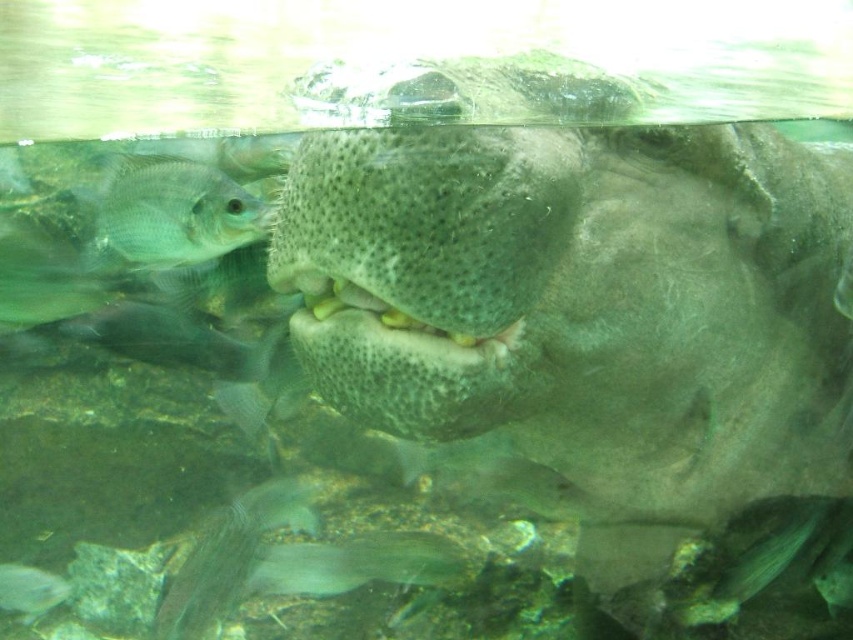
Who is more forward, (802, 506) or (1, 595)?

Point (802, 506) is more forward.

Between green matte fish at lower right and translucent gray fish at lower left, which one has less height?

translucent gray fish at lower left is shorter.

Is point (770, 561) positioned before point (45, 586)?

Yes.

Image resolution: width=853 pixels, height=640 pixels. In order to click on green matte fish at lower right in this screenshot , I will do `click(770, 554)`.

Does spongy greenish mouth at center appear on the right side of translucent gray fish at lower left?

Correct, you'll find spongy greenish mouth at center to the right of translucent gray fish at lower left.

The width and height of the screenshot is (853, 640). Find the location of `spongy greenish mouth at center`. spongy greenish mouth at center is located at coordinates (395, 317).

Is spongy greenish mouth at center shorter than green matte fish at lower right?

Indeed, spongy greenish mouth at center has a lesser height compared to green matte fish at lower right.

Who is shorter, spongy greenish mouth at center or green matte fish at lower right?

spongy greenish mouth at center

Is point (442, 344) positioned before point (824, 513)?

That is True.

Image resolution: width=853 pixels, height=640 pixels. What are the coordinates of `spongy greenish mouth at center` in the screenshot? It's located at click(x=395, y=317).